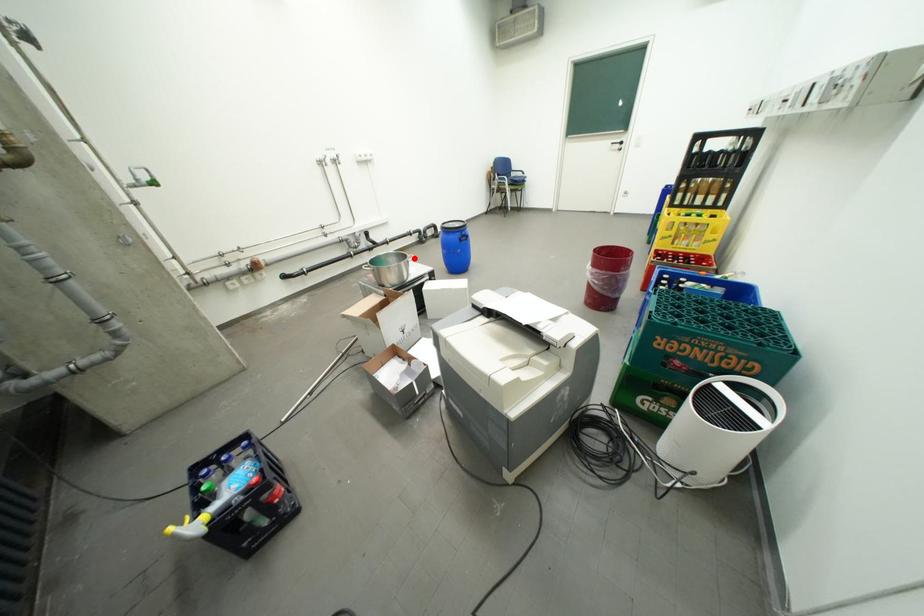
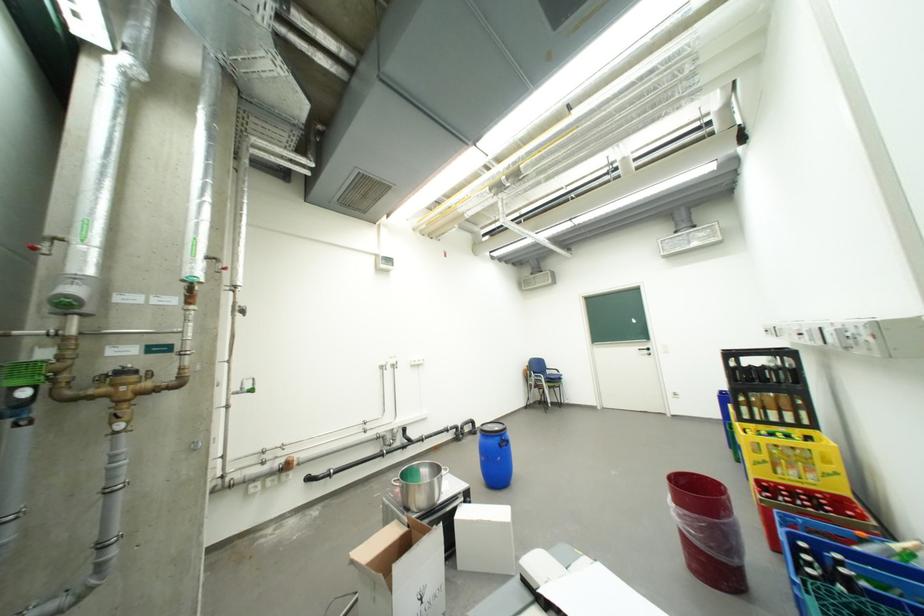
Question: I am providing you with two images of the same scene from different viewpoints. Given a red point in image1, look at the same physical point in image2. Is it:

Choices:
 (A) Closer to the viewpoint
 (B) Farther from the viewpoint

Answer: (A)